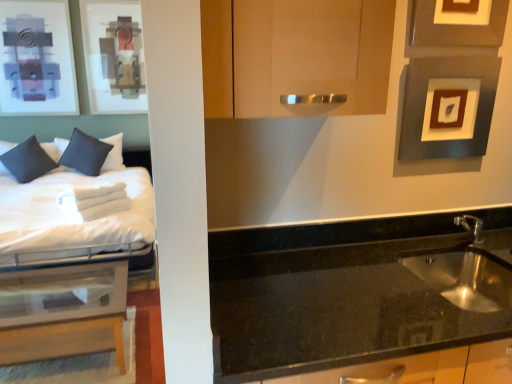
In order to face translucent glass table at left, should I rotate leftwards or rightwards?

You should look left and rotate roughly 24.964 degrees.

Image resolution: width=512 pixels, height=384 pixels. I want to click on black granite sink at lower right, so click(362, 302).

I want to click on matte gray picture frame at upper right, positioned as the first picture frame in top-to-bottom order, so click(x=456, y=27).

Describe the element at coordinates (85, 153) in the screenshot. I see `matte black pillow at left, which is the 1th pillow from right to left` at that location.

You are a GUI agent. You are given a task and a screenshot of the screen. Output one action in this format:
    pyautogui.click(x=<x>, y=<y>)
    Task: Click on the matte gray picture frame at upper right, the first picture frame in the bottom-to-top sequence
    The width and height of the screenshot is (512, 384).
    Given the screenshot: What is the action you would take?
    pyautogui.click(x=424, y=106)

Describe the element at coordinates (76, 207) in the screenshot. I see `white soft bed at left` at that location.

Identify the location of translucent glass table at left. The width and height of the screenshot is (512, 384). pos(62,312).

Is white soft bed at left smaller than matte black pillow at left, the second pillow when ordered from left to right?

Incorrect, white soft bed at left is not smaller in size than matte black pillow at left, the second pillow when ordered from left to right.

In the scene shown: Can you see white soft bed at left touching matte black pillow at left, the second pillow when ordered from left to right?

There is a gap between white soft bed at left and matte black pillow at left, the second pillow when ordered from left to right.

Looking at their sizes, would you say white soft bed at left is wider or thinner than matte black pillow at left, which is the 1th pillow from right to left?

Considering their sizes, white soft bed at left looks broader than matte black pillow at left, which is the 1th pillow from right to left.

From a real-world perspective, relative to matte black pillow at left, the second pillow when ordered from left to right, is white soft bed at left vertically above or below?

white soft bed at left is below matte black pillow at left, the second pillow when ordered from left to right.

Is dark blue fabric pillow at left, which appears as the first pillow when viewed from the left, behind translucent glass table at left?

Yes, dark blue fabric pillow at left, which appears as the first pillow when viewed from the left, is further from the viewer.

Looking at this image, can you confirm if dark blue fabric pillow at left, which appears as the second pillow when viewed from the right, is wider than translucent glass table at left?

No.

Is dark blue fabric pillow at left, which appears as the first pillow when viewed from the left, to the right of translucent glass table at left from the viewer's perspective?

Incorrect, dark blue fabric pillow at left, which appears as the first pillow when viewed from the left, is not on the right side of translucent glass table at left.

Is matte wood cabinet at center not near matte gray picture frame at upper right, which ranks as the 2th picture frame in bottom-to-top order?

matte wood cabinet at center is near matte gray picture frame at upper right, which ranks as the 2th picture frame in bottom-to-top order, not far away.

Who is smaller, matte wood cabinet at center or matte gray picture frame at upper right, which ranks as the 2th picture frame in bottom-to-top order?

matte gray picture frame at upper right, which ranks as the 2th picture frame in bottom-to-top order, is smaller.

Can you confirm if matte wood cabinet at center is positioned to the right of matte gray picture frame at upper right, positioned as the first picture frame in top-to-bottom order?

No.

Based on the photo, can you confirm if white soft bed at left is bigger than matte gray picture frame at upper right, which ranks as the 2th picture frame in bottom-to-top order?

Indeed, white soft bed at left has a larger size compared to matte gray picture frame at upper right, which ranks as the 2th picture frame in bottom-to-top order.

Is point (141, 248) closer to viewer compared to point (436, 28)?

No, it is not.

Between white soft bed at left and matte gray picture frame at upper right, which ranks as the 2th picture frame in bottom-to-top order, which one has larger width?

white soft bed at left is wider.

Is matte gray picture frame at upper right, positioned as the first picture frame in top-to-bottom order, surrounded by white soft bed at left?

Definitely not — matte gray picture frame at upper right, positioned as the first picture frame in top-to-bottom order, is not inside white soft bed at left.

Which is in front, matte black pillow at left, which is the 1th pillow from right to left, or white soft bed at left?

white soft bed at left is closer to the camera.

Is matte black pillow at left, the second pillow when ordered from left to right, looking in the opposite direction of white soft bed at left?

That's right, matte black pillow at left, the second pillow when ordered from left to right, is facing away from white soft bed at left.

How many degrees apart are the facing directions of matte black pillow at left, which is the 1th pillow from right to left, and white soft bed at left?

The angle between the facing direction of matte black pillow at left, which is the 1th pillow from right to left, and the facing direction of white soft bed at left is 1.46 degrees.

Looking at this image, considering the relative positions of matte black pillow at left, which is the 1th pillow from right to left, and white soft bed at left in the image provided, is matte black pillow at left, which is the 1th pillow from right to left, to the left of white soft bed at left from the viewer's perspective?

No, matte black pillow at left, which is the 1th pillow from right to left, is not to the left of white soft bed at left.

Considering the sizes of objects matte gray picture frame at upper right, placed as the second picture frame when sorted from top to bottom, and dark blue fabric pillow at left, which appears as the second pillow when viewed from the right, in the image provided, who is taller, matte gray picture frame at upper right, placed as the second picture frame when sorted from top to bottom, or dark blue fabric pillow at left, which appears as the second pillow when viewed from the right,?

With more height is dark blue fabric pillow at left, which appears as the second pillow when viewed from the right.

Between matte gray picture frame at upper right, placed as the second picture frame when sorted from top to bottom, and dark blue fabric pillow at left, which appears as the second pillow when viewed from the right, which one has smaller size?

With smaller size is matte gray picture frame at upper right, placed as the second picture frame when sorted from top to bottom.

Identify the location of the 1st picture frame located above the dark blue fabric pillow at left, which appears as the second pillow when viewed from the right (from a real-world perspective). The image size is (512, 384). (424, 106).

Considering the positions of point (21, 164) and point (67, 155), is point (21, 164) closer or farther from the camera than point (67, 155)?

Point (21, 164) appears to be closer to the viewer than point (67, 155).

Is dark blue fabric pillow at left, which appears as the second pillow when viewed from the right, not near matte black pillow at left, the second pillow when ordered from left to right?

No, dark blue fabric pillow at left, which appears as the second pillow when viewed from the right, is not far away from matte black pillow at left, the second pillow when ordered from left to right.

Does dark blue fabric pillow at left, which appears as the first pillow when viewed from the left, turn towards matte black pillow at left, which is the 1th pillow from right to left?

No, dark blue fabric pillow at left, which appears as the first pillow when viewed from the left, is not turned towards matte black pillow at left, which is the 1th pillow from right to left.

From the image's perspective, does dark blue fabric pillow at left, which appears as the second pillow when viewed from the right, appear lower than matte black pillow at left, the second pillow when ordered from left to right?

Yes, from the image's perspective, dark blue fabric pillow at left, which appears as the second pillow when viewed from the right, is below matte black pillow at left, the second pillow when ordered from left to right.

The width and height of the screenshot is (512, 384). I want to click on bed below the matte black pillow at left, the second pillow when ordered from left to right (from the image's perspective), so click(76, 207).

Locate an element on the screen. table directly beneath the dark blue fabric pillow at left, which appears as the second pillow when viewed from the right (from a real-world perspective) is located at coordinates (62, 312).

Looking at the image, which one is located further to black granite sink at lower right, white soft bed at left or translucent glass table at left?

white soft bed at left.

Looking at the image, which one is located closer to translucent glass table at left, matte black pillow at left, which is the 1th pillow from right to left, or matte gray picture frame at upper right, the first picture frame in the bottom-to-top sequence?

Based on the image, matte black pillow at left, which is the 1th pillow from right to left, appears to be nearer to translucent glass table at left.

Which object lies further to the anchor point matte wood cabinet at center, black granite sink at lower right or silver metallic faucet at lower right?

silver metallic faucet at lower right.

From the image, which object appears to be nearer to black granite sink at lower right, translucent glass table at left or matte wood cabinet at center?

Among the two, matte wood cabinet at center is located nearer to black granite sink at lower right.

Looking at the image, which one is located further to matte gray picture frame at upper right, placed as the second picture frame when sorted from top to bottom, dark blue fabric pillow at left, which appears as the second pillow when viewed from the right, or silver metallic faucet at lower right?

Among the two, dark blue fabric pillow at left, which appears as the second pillow when viewed from the right, is located further to matte gray picture frame at upper right, placed as the second picture frame when sorted from top to bottom.

Based on their spatial positions, is black granite sink at lower right or matte gray picture frame at upper right, positioned as the first picture frame in top-to-bottom order, further from dark blue fabric pillow at left, which appears as the second pillow when viewed from the right?

matte gray picture frame at upper right, positioned as the first picture frame in top-to-bottom order, is further to dark blue fabric pillow at left, which appears as the second pillow when viewed from the right.

When comparing their distances from black granite sink at lower right, does matte gray picture frame at upper right, positioned as the first picture frame in top-to-bottom order, or matte black pillow at left, the second pillow when ordered from left to right, seem further?

matte black pillow at left, the second pillow when ordered from left to right, is positioned further to the anchor black granite sink at lower right.

Based on their spatial positions, is matte gray picture frame at upper right, which ranks as the 2th picture frame in bottom-to-top order, or black granite sink at lower right further from white soft bed at left?

The object further to white soft bed at left is matte gray picture frame at upper right, which ranks as the 2th picture frame in bottom-to-top order.

The width and height of the screenshot is (512, 384). In order to click on table between matte wood cabinet at center and dark blue fabric pillow at left, which appears as the second pillow when viewed from the right, along the z-axis in this screenshot , I will do `click(62, 312)`.

Identify the location of bed positioned between black granite sink at lower right and matte black pillow at left, the second pillow when ordered from left to right, from near to far. Image resolution: width=512 pixels, height=384 pixels. (76, 207).

The image size is (512, 384). What are the coordinates of `bed between dark blue fabric pillow at left, which appears as the first pillow when viewed from the left, and silver metallic faucet at lower right` in the screenshot? It's located at click(76, 207).

Where is `cabinetry between black granite sink at lower right and dark blue fabric pillow at left, which appears as the first pillow when viewed from the left, along the z-axis`? This screenshot has width=512, height=384. cabinetry between black granite sink at lower right and dark blue fabric pillow at left, which appears as the first pillow when viewed from the left, along the z-axis is located at coordinates (295, 55).